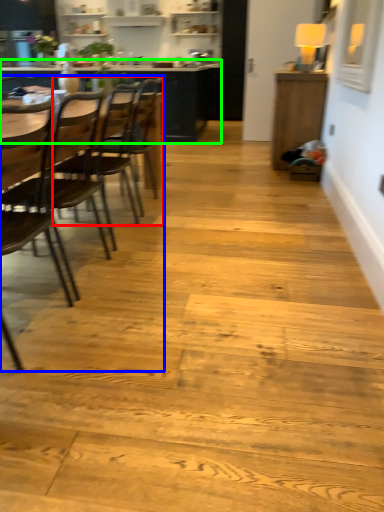
Question: Estimate the real-world distances between objects in this image. Which object is closer to chair (highlighted by a red box), armchair (highlighted by a blue box) or table (highlighted by a green box)?

Choices:
 (A) armchair
 (B) table

Answer: (A)